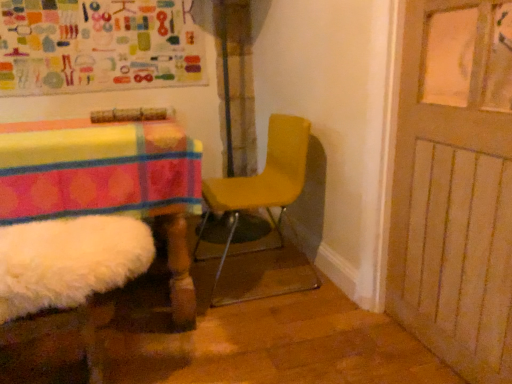
Question: In the image, is yellow matte chair at center positioned in front of or behind wooden door at right?

Choices:
 (A) front
 (B) behind

Answer: (B)

Question: Does point (307, 129) appear closer or farther from the camera than point (471, 69)?

Choices:
 (A) farther
 (B) closer

Answer: (A)

Question: Which object is positioned farthest from the yellow matte chair at center?

Choices:
 (A) colorful fabric bulletin board at upper left
 (B) wooden door at right

Answer: (A)

Question: Which object is the farthest from the colorful fabric bulletin board at upper left?

Choices:
 (A) yellow matte chair at center
 (B) wooden door at right

Answer: (B)